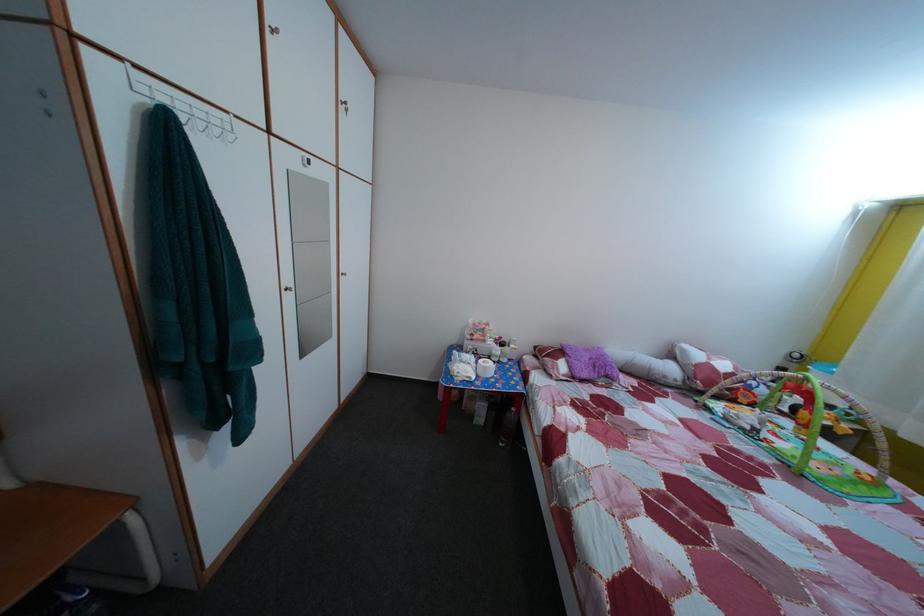
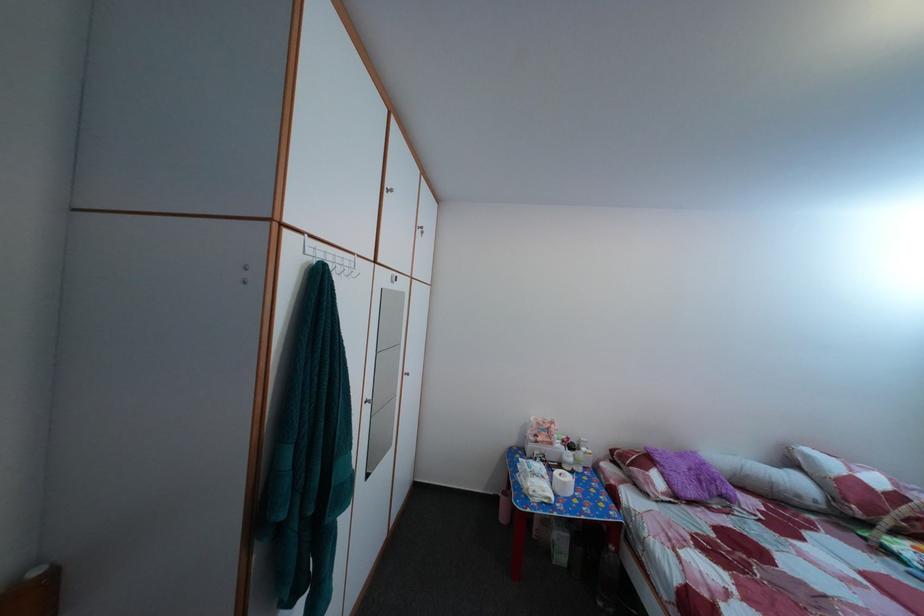
Question: The images are taken continuously from a first-person perspective. In which direction is your viewpoint rotating?

Choices:
 (A) Left
 (B) Right
 (C) Up
 (D) Down

Answer: (C)